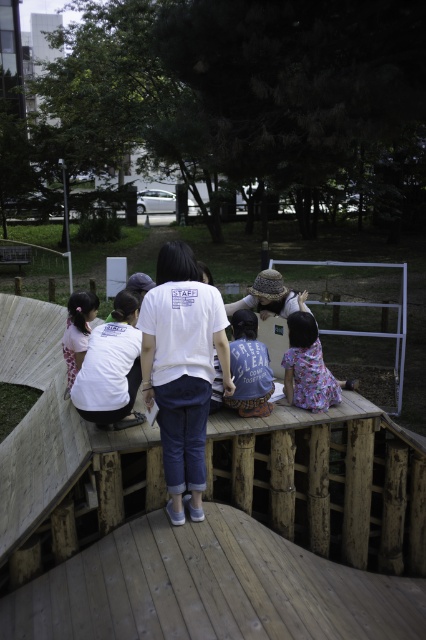
You are a photographer positioned at the edge of the wooden platform. You want to take a photo that includes both the denim shirt at center and the white floral dress at lower left. Based on their positions, which direction should you move to ensure both subjects are in frame?

The denim shirt at center is to the right of the white floral dress at lower left. To include both in the frame, you should move to the left side of the platform so that the white floral dress at lower left comes into view while keeping the denim shirt at center in sight.